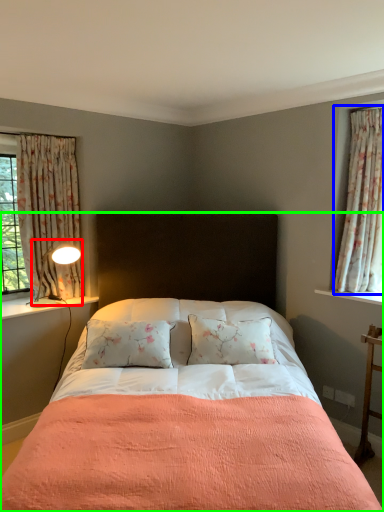
Question: Which object is the farthest from light fixture (highlighted by a red box)? Choose among these: curtain (highlighted by a blue box) or bed (highlighted by a green box).

Choices:
 (A) curtain
 (B) bed

Answer: (A)